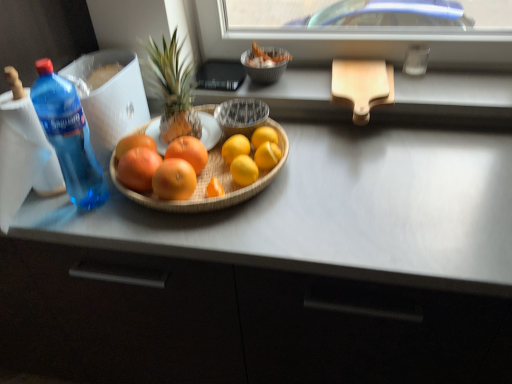
Where is `vacant point to the left of orange matte grapefruit at center, arranged as the 3th grapefruit when viewed from the left`? vacant point to the left of orange matte grapefruit at center, arranged as the 3th grapefruit when viewed from the left is located at coordinates (106, 210).